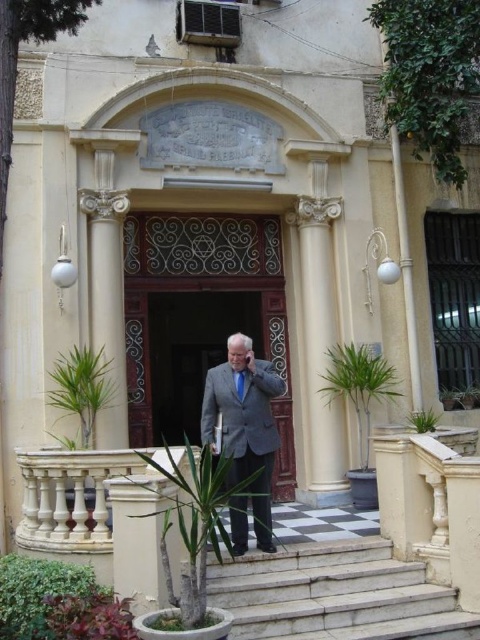
You are standing at the entrance of the building and want to go upstairs. Where are the white marble stairs at center located relative to your position?

The white marble stairs at center are located at point 0.930 on the x axis and 0.698 on the y axis relative to your position at the entrance.

You are a visitor arriving at this building and need to enter. You see the white marble stairs at center and the light gray suit at center. Which object is smaller in size?

The white marble stairs at center is smaller in size compared to the light gray suit at center.

You are a visitor approaching the entrance of this classical building. You notice the wooden door at center and the blue silk tie at center. Which object is bigger in size?

The wooden door at center is larger in size than the blue silk tie at center.